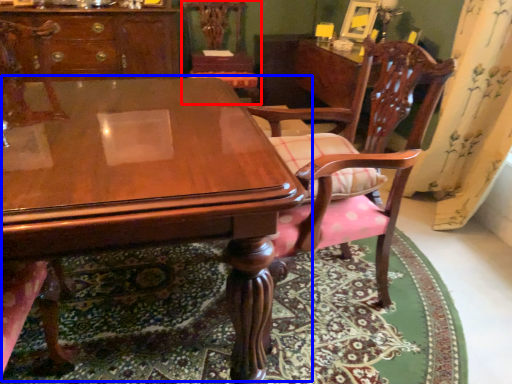
Question: Among these objects, which one is farthest to the camera, chair (highlighted by a red box) or table (highlighted by a blue box)?

Choices:
 (A) chair
 (B) table

Answer: (A)